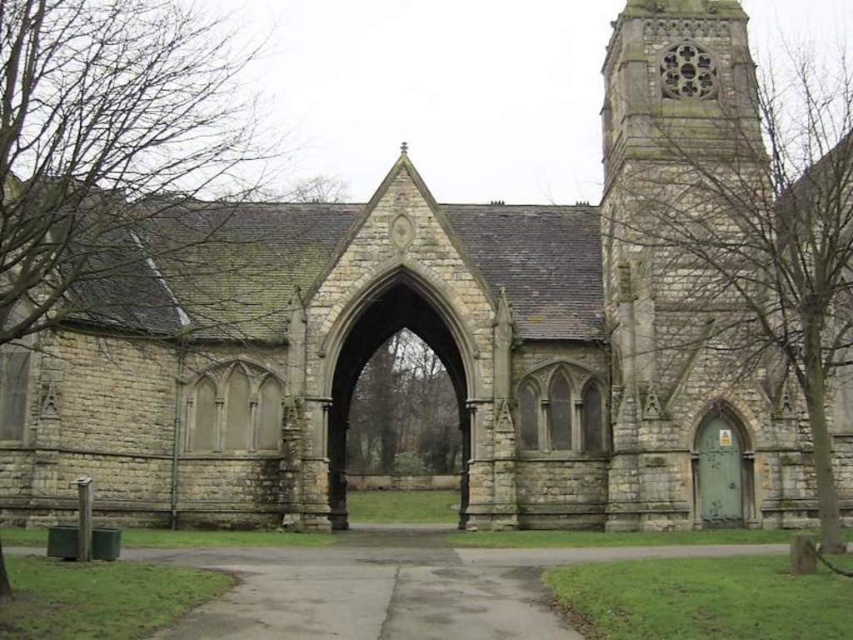
You are standing at the entrance of the historic stone church and notice a point marked at coordinates (119, 166). What object is located at this coordinate?

The point at coordinates (119, 166) indicates the location of bare branches at the left.

You are standing in front of the historic stone church and want to take a photo of the bare branches at left and the green leafy tree at center. Which tree should you focus on first if you want to capture both in the frame without moving the camera?

The bare branches at left is positioned on the left side of green leafy tree at center, so you should focus on the bare branches at left first to ensure both are in the frame without moving the camera.